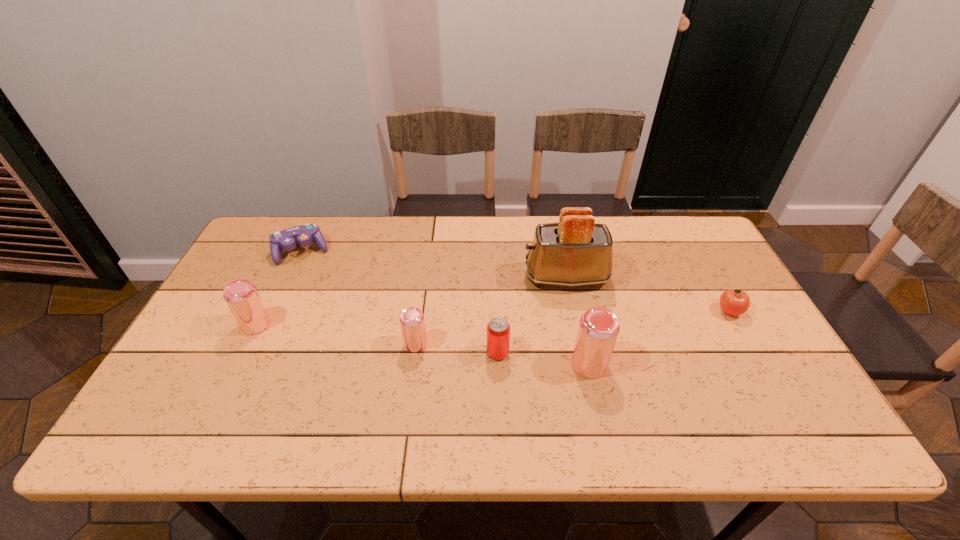
Locate an element on the screen. The height and width of the screenshot is (540, 960). free space between the apple and the tallest object is located at coordinates (648, 295).

The height and width of the screenshot is (540, 960). I want to click on free area in between the second tallest object and the tallest object, so (578, 321).

Point out which object is positioned as the fifth nearest to the fifth shortest object. Please provide its 2D coordinates. Your answer should be formatted as a tuple, i.e. [(x, y)], where the tuple contains the x and y coordinates of a point satisfying the conditions above.

[(598, 329)]

Locate an element on the screen. This screenshot has height=540, width=960. the sixth closest object relative to the second beer can from right to left is located at coordinates (734, 302).

Where is `beer can identified as the closest to the fourth object from left to right`? The image size is (960, 540). beer can identified as the closest to the fourth object from left to right is located at coordinates (598, 329).

Identify which beer can is the closest to the second shortest object. Please provide its 2D coordinates. Your answer should be formatted as a tuple, i.e. [(x, y)], where the tuple contains the x and y coordinates of a point satisfying the conditions above.

[(598, 329)]

Identify the location of vacant space that satisfies the following two spatial constraints: 1. on the side of the toaster with the control lever; 2. on the right side of the rightmost object. (573, 312).

Where is `free spot that satisfies the following two spatial constraints: 1. on the front side of the second beer can from left to right; 2. on the right side of the tallest beer can`? This screenshot has width=960, height=540. free spot that satisfies the following two spatial constraints: 1. on the front side of the second beer can from left to right; 2. on the right side of the tallest beer can is located at coordinates (413, 364).

At what (x,y) coordinates should I click in order to perform the action: click on vacant position in the image that satisfies the following two spatial constraints: 1. on the back side of the rightmost beer can; 2. on the side of the tallest object with the control lever. Please return your answer as a coordinate pair (x, y). Looking at the image, I should click on (570, 278).

You are a GUI agent. You are given a task and a screenshot of the screen. Output one action in this format:
    pyautogui.click(x=<x>, y=<y>)
    Task: Click on the blank space that satisfies the following two spatial constraints: 1. on the side of the second tallest object with the control lever; 2. on the right side of the tallest object
    The height and width of the screenshot is (540, 960).
    Given the screenshot: What is the action you would take?
    click(584, 364)